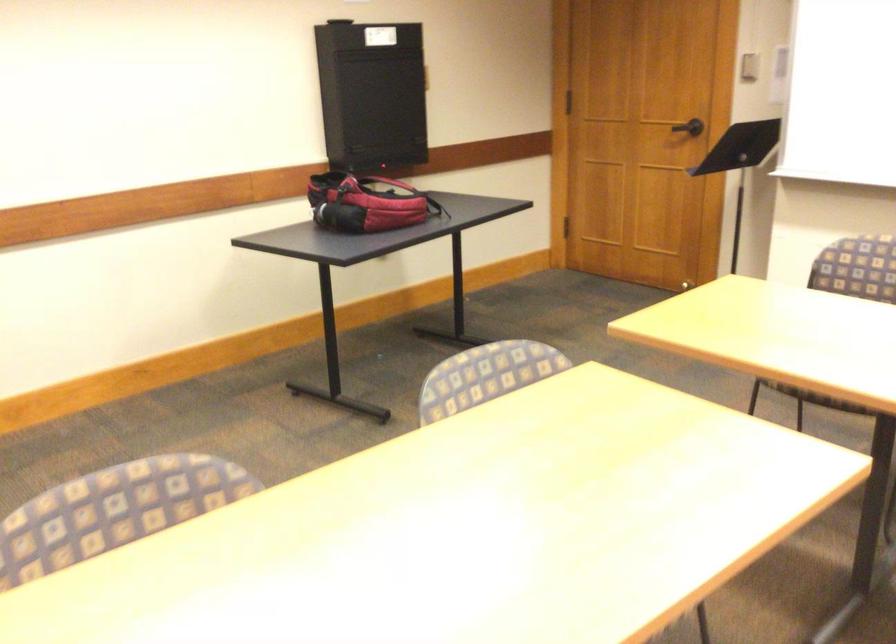
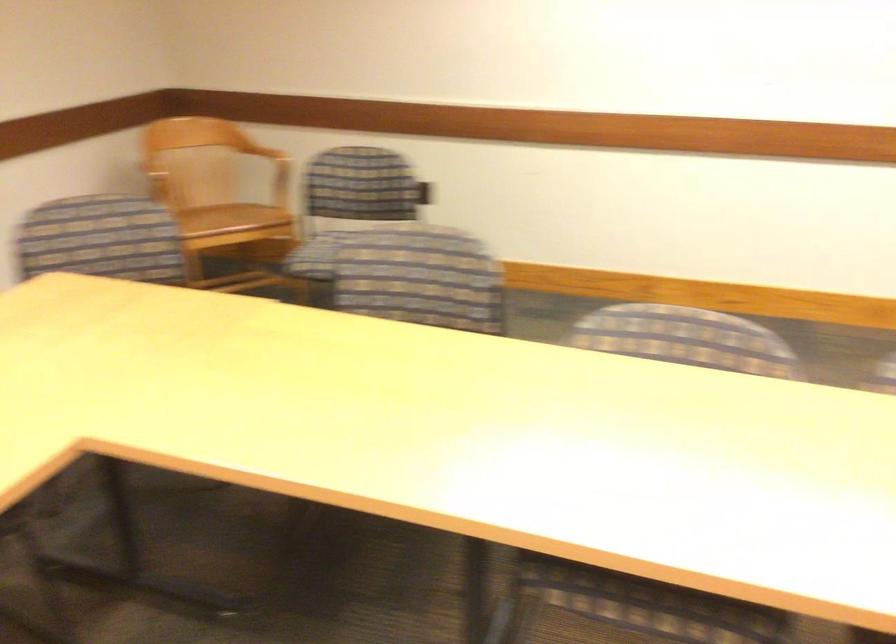
Question: The camera is either moving clockwise (left) or counter-clockwise (right) around the object. The first image is from the beginning of the video and the second image is from the end. Is the camera moving left or right when shooting the video?

Choices:
 (A) Left
 (B) Right

Answer: (B)